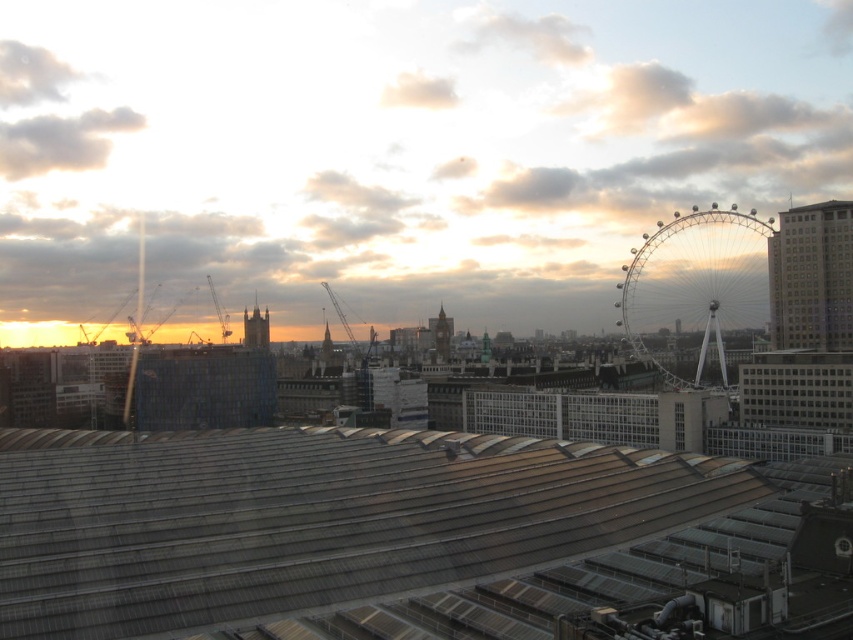
Question: Which object appears farthest from the camera in this image?

Choices:
 (A) silver metallic ferris wheel at upper right
 (B) metallic gray roof at center

Answer: (A)

Question: Is metallic gray roof at center positioned behind silver metallic ferris wheel at upper right?

Choices:
 (A) no
 (B) yes

Answer: (A)

Question: Is metallic gray roof at center below silver metallic ferris wheel at upper right?

Choices:
 (A) no
 (B) yes

Answer: (B)

Question: Among these points, which one is nearest to the camera?

Choices:
 (A) (439, 444)
 (B) (767, 224)

Answer: (A)

Question: Is metallic gray roof at center wider than silver metallic ferris wheel at upper right?

Choices:
 (A) no
 (B) yes

Answer: (B)